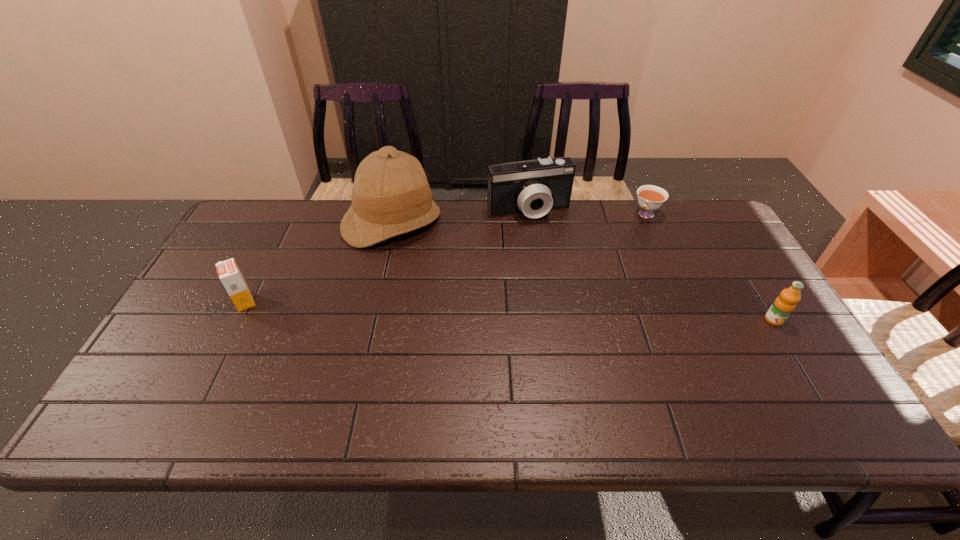
The image size is (960, 540). What are the coordinates of `free space at the far left corner` in the screenshot? It's located at (273, 209).

Find the location of `vacant region at the near right corner`. vacant region at the near right corner is located at coordinates (766, 383).

Identify the location of free space that is in between the farther orange juice and the third object from left to right. (387, 256).

Where is `free spot between the teacup and the right orange juice`? This screenshot has width=960, height=540. free spot between the teacup and the right orange juice is located at coordinates (709, 267).

Find the location of a particular element. Image resolution: width=960 pixels, height=540 pixels. empty location between the third object from left to right and the leftmost object is located at coordinates (x=387, y=256).

You are a GUI agent. You are given a task and a screenshot of the screen. Output one action in this format:
    pyautogui.click(x=<x>, y=<y>)
    Task: Click on the vacant area that lies between the tallest object and the fourth shortest object
    This screenshot has width=960, height=540.
    Given the screenshot: What is the action you would take?
    pyautogui.click(x=460, y=217)

Where is `free space between the fourth farthest object and the tallest object`? free space between the fourth farthest object and the tallest object is located at coordinates (318, 262).

This screenshot has width=960, height=540. Identify the location of unoccupied position between the right orange juice and the second object from right to left. (709, 267).

Find the location of a particular element. The width and height of the screenshot is (960, 540). vacant point located between the third object from right to left and the nearest object is located at coordinates (651, 266).

Locate an element on the screen. The image size is (960, 540). free spot between the third object from left to right and the teacup is located at coordinates (588, 213).